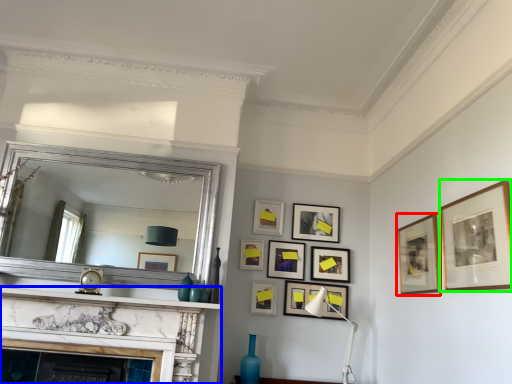
Question: Based on their relative distances, which object is nearer to picture frame (highlighted by a red box)? Choose from fireplace (highlighted by a blue box) and picture frame (highlighted by a green box).

Choices:
 (A) fireplace
 (B) picture frame

Answer: (B)